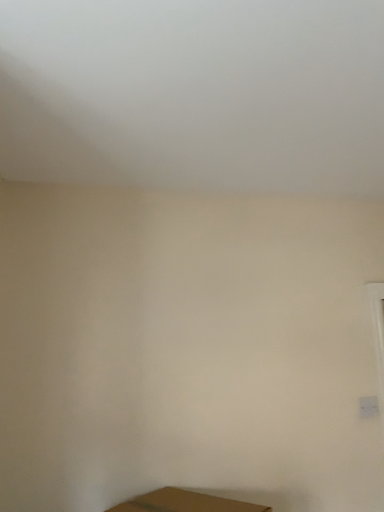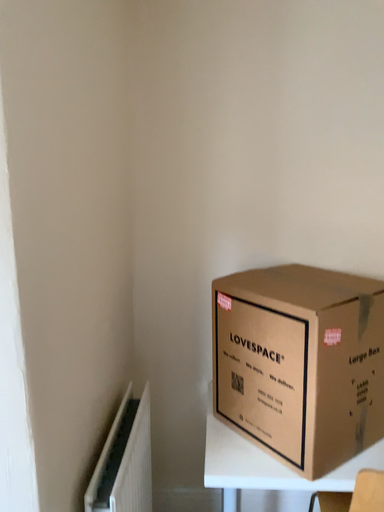
Question: Which way did the camera rotate in the video?

Choices:
 (A) rotated left
 (B) rotated right

Answer: (A)